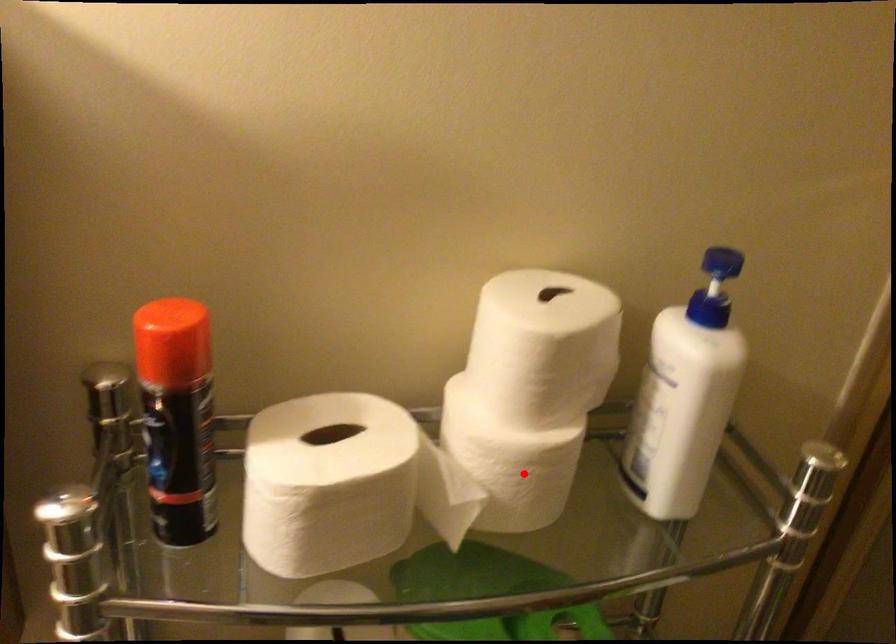
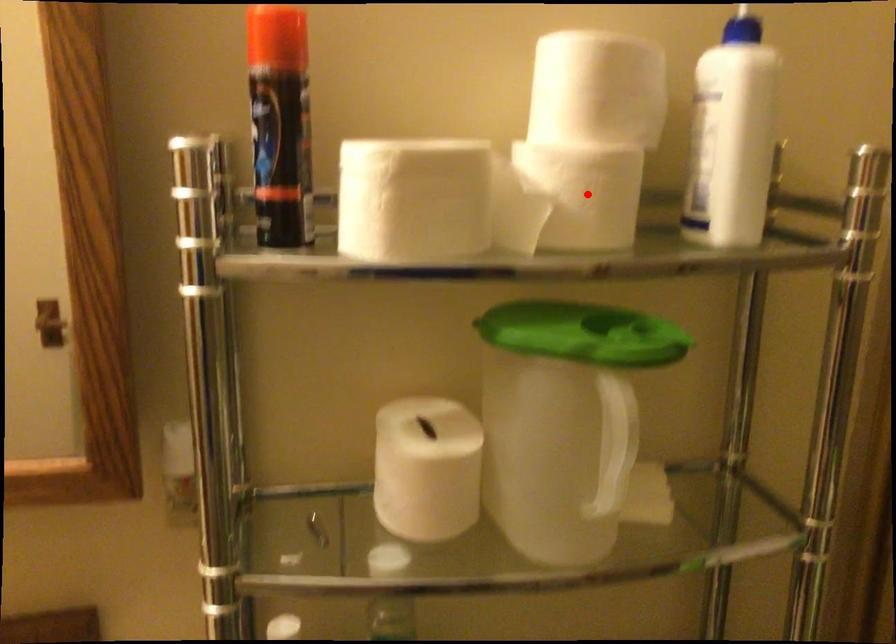
In the scene shown: I am providing you with two images of the same scene from different viewpoints. A red point is marked on the first image and another point is marked on the second image. Is the red point in image1 aligned with the point shown in image2?

Yes